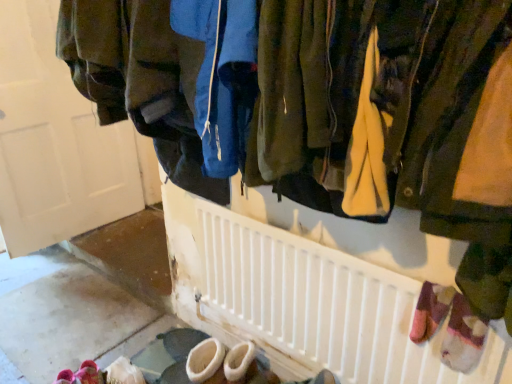
Question: Looking at their shapes, would you say matte white door at upper left is wider or thinner than white plastic radiator at center?

Choices:
 (A) wide
 (B) thin

Answer: (A)

Question: From the image's perspective, is matte white door at upper left above or below white plastic radiator at center?

Choices:
 (A) below
 (B) above

Answer: (B)

Question: Estimate the real-world distances between objects in this image. Which object is farther from the white plastic radiator at center?

Choices:
 (A) matte white door at upper left
 (B) pink fuzzy slippers at lower left

Answer: (A)

Question: Which is nearer to the matte white door at upper left?

Choices:
 (A) pink fuzzy slippers at lower left
 (B) white plastic radiator at center

Answer: (A)